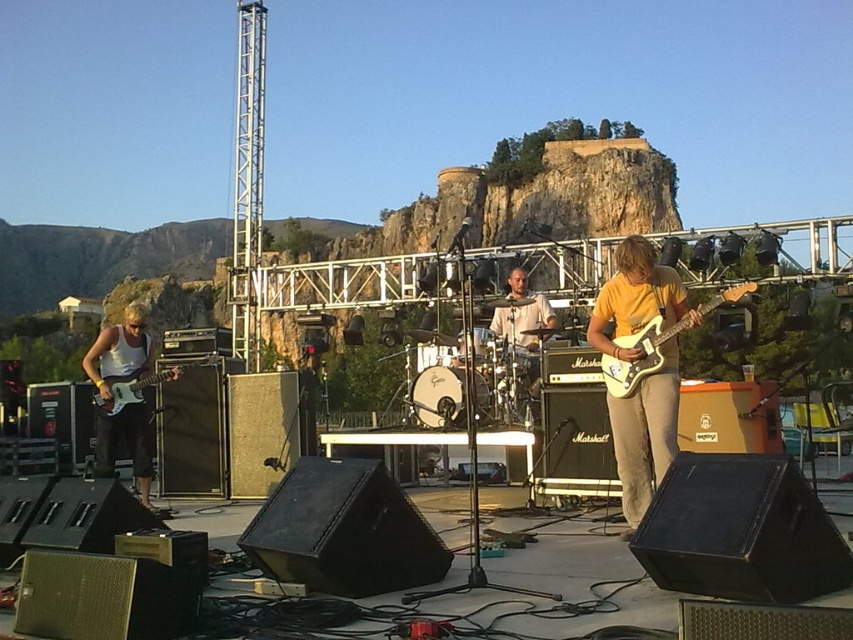
You are a sound technician adjusting the speaker angles to ensure the drummer at the light beige drum set at center can hear themselves clearly. Given the stage layout, where should you aim the front speakers relative to the drummer?

The light beige drum set at center is located at coordinates point (524, 330), so the front speakers should be angled towards that position to ensure the drummer can hear themselves clearly.

You are a sound engineer setting up a new speaker at the front of the stage. The existing speakers are angled towards the audience. To ensure the new speaker faces the drummer at the light beige drum set at center, where should you position it relative to the existing speakers?

The light beige drum set at center is located at point (524, 330). Position the new speaker so it faces this coordinate to align with the drummer.